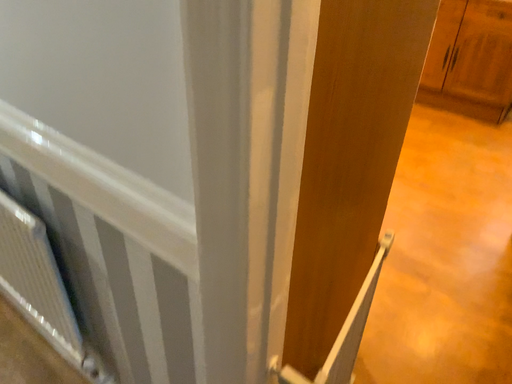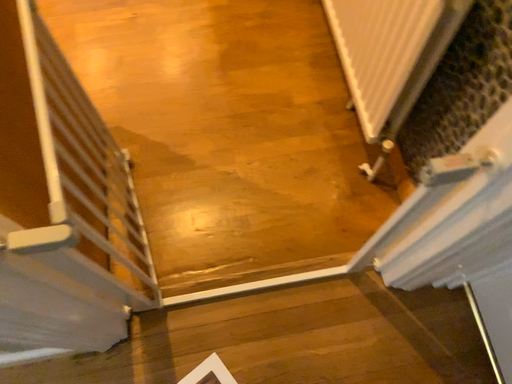
Question: Which way did the camera rotate in the video?

Choices:
 (A) rotated right
 (B) rotated left

Answer: (A)